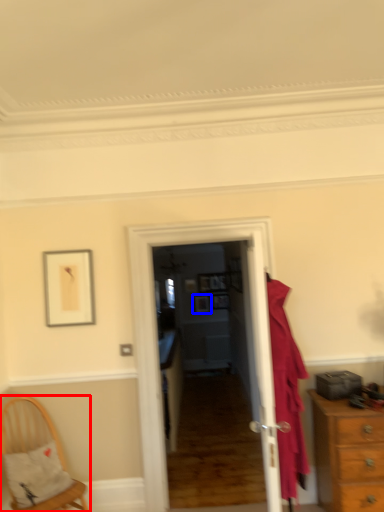
Question: Among these objects, which one is farthest to the camera, chair (highlighted by a red box) or picture frame (highlighted by a blue box)?

Choices:
 (A) chair
 (B) picture frame

Answer: (B)